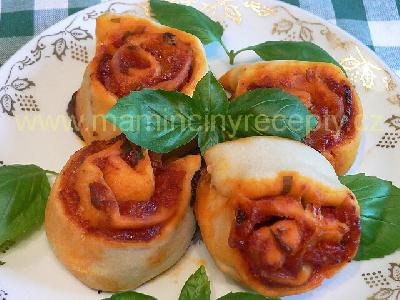
At what (x,y) coordinates should I click in order to perform the action: click on table cloth. Please return your answer as a coordinate pair (x, y). This screenshot has height=300, width=400. Looking at the image, I should click on (356, 30), (38, 14).